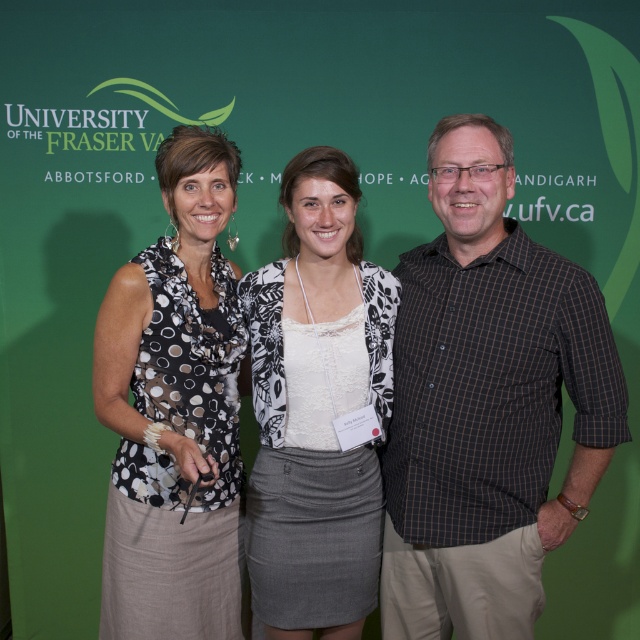
Question: Which object is the closest to the brown checkered shirt at center?

Choices:
 (A) white textured blouse at center
 (B) black dotted blouse at left

Answer: (A)

Question: Is brown checkered shirt at center to the right of black dotted blouse at left from the viewer's perspective?

Choices:
 (A) yes
 (B) no

Answer: (A)

Question: Which point is closer to the camera?

Choices:
 (A) (380, 493)
 (B) (147, 400)

Answer: (B)

Question: Which point is closer to the camera taking this photo?

Choices:
 (A) (513, 632)
 (B) (314, 284)
 (C) (204, 557)

Answer: (A)

Question: Is brown checkered shirt at center closer to the viewer compared to white textured blouse at center?

Choices:
 (A) no
 (B) yes

Answer: (B)

Question: Can you confirm if black dotted blouse at left is positioned to the left of white textured blouse at center?

Choices:
 (A) yes
 (B) no

Answer: (A)